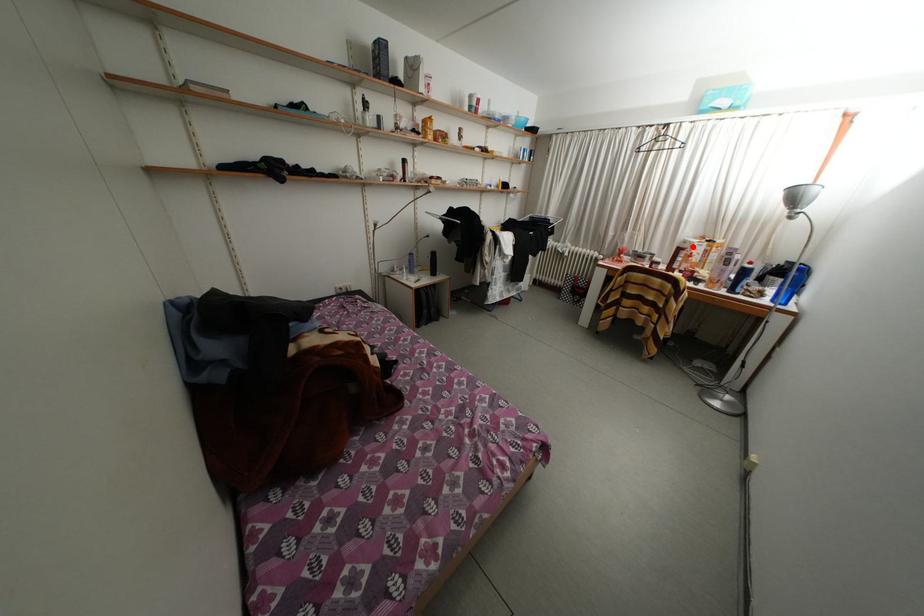
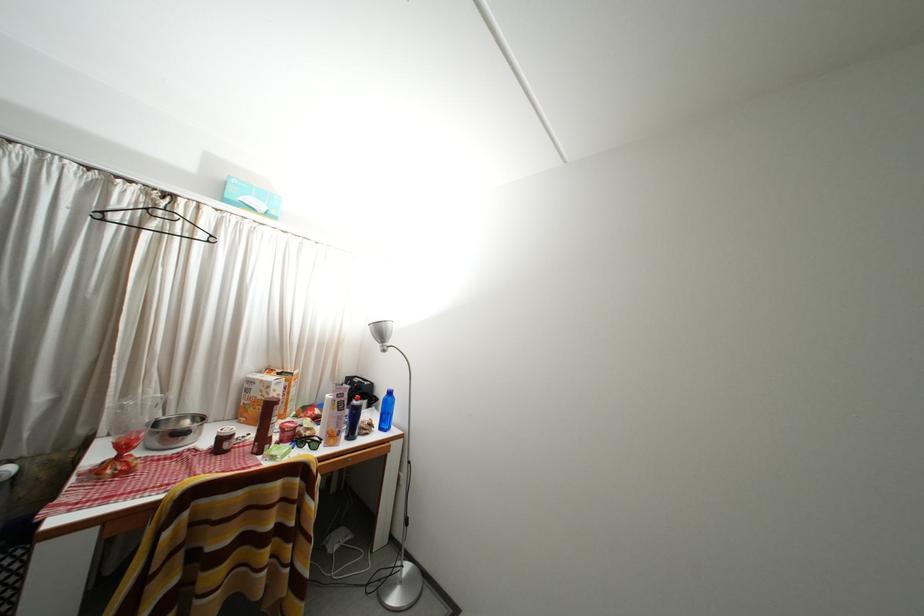
Question: I am providing you with two images of the same scene from different viewpoints. A red point is shown in image1. For the corresponding object point in image2, is it positioned nearer or farther from the camera?

Choices:
 (A) Nearer
 (B) Farther

Answer: (B)